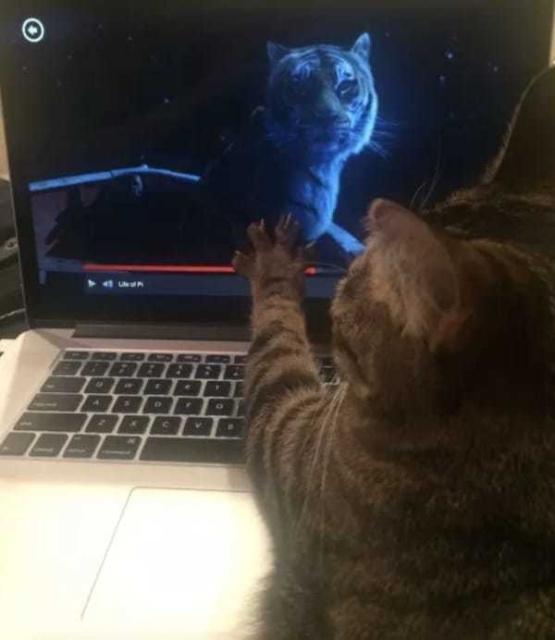
Where is `monitor`? This screenshot has height=640, width=555. monitor is located at coordinates (27, 225).